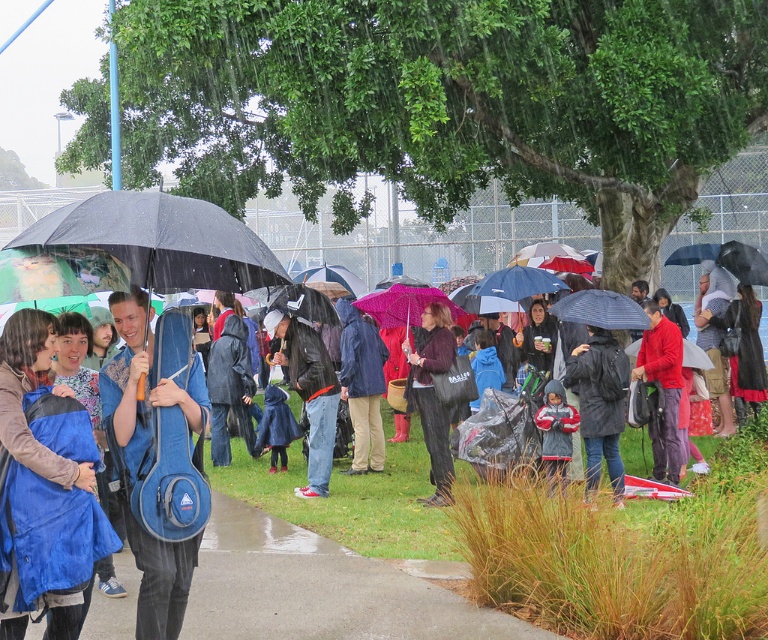
Question: Which is nearer to the blue fabric bag at center?

Choices:
 (A) red matte jacket at center
 (B) dark gray matte jacket at center

Answer: (B)

Question: Observing the image, what is the correct spatial positioning of blue fabric bag at center in reference to denim jacket at center?

Choices:
 (A) right
 (B) left

Answer: (B)

Question: Which of these objects is positioned closest to the blue fabric bag at center?

Choices:
 (A) red matte jacket at center
 (B) denim jacket at center
 (C) black matte umbrella at center

Answer: (C)

Question: Where is blue fabric bag at center located in relation to red matte jacket at center in the image?

Choices:
 (A) above
 (B) below

Answer: (B)

Question: Which point is closer to the camera taking this photo?

Choices:
 (A) (320, 360)
 (B) (127, 307)
 (C) (227, 228)

Answer: (C)

Question: Does blue fabric guitar case at center appear over red matte jacket at center?

Choices:
 (A) no
 (B) yes

Answer: (A)